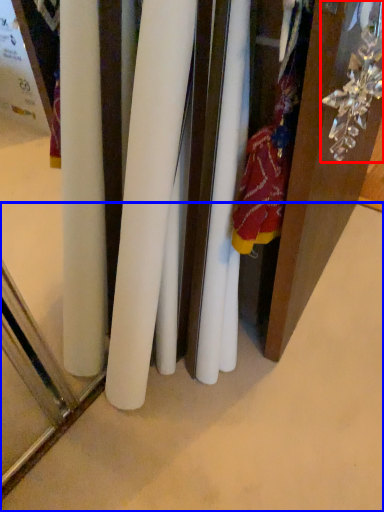
Question: Which point is further to the camera, accessory (highlighted by a red box) or surface (highlighted by a blue box)?

Choices:
 (A) accessory
 (B) surface

Answer: (B)